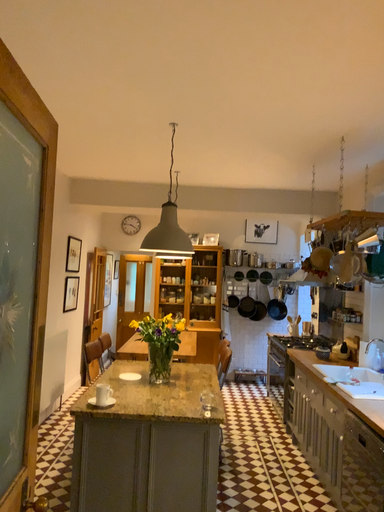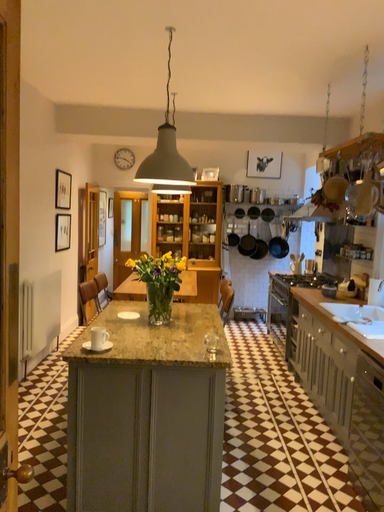
Question: Which way did the camera rotate in the video?

Choices:
 (A) rotated downward
 (B) rotated upward

Answer: (A)